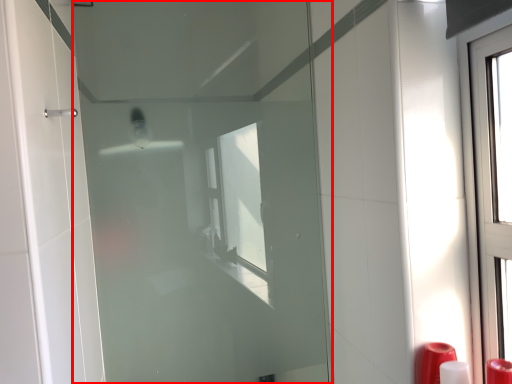
Question: Observing the image, what is the correct spatial positioning of door (annotated by the red box) in reference to soap dispenser?

Choices:
 (A) right
 (B) left

Answer: (B)